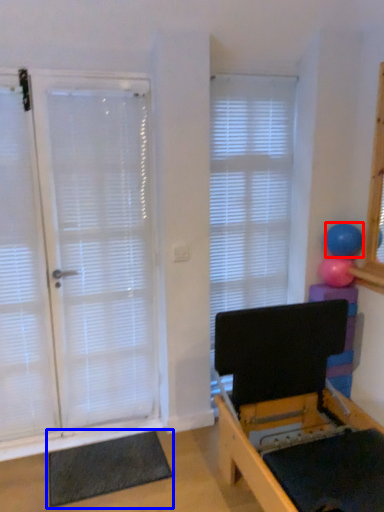
Question: Among these objects, which one is nearest to the camera, ball (highlighted by a red box) or yoga mat (highlighted by a blue box)?

Choices:
 (A) ball
 (B) yoga mat

Answer: (B)